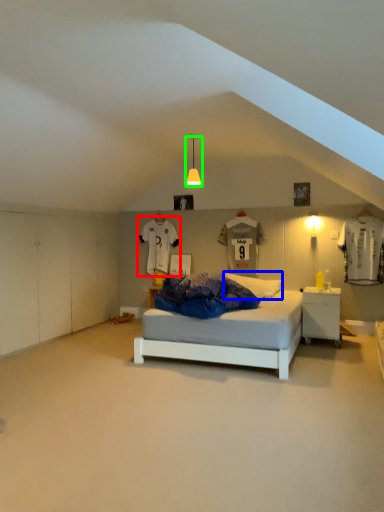
Question: Which is nearer to the t shirt (highlighted by a red box)? pillow (highlighted by a blue box) or light fixture (highlighted by a green box).

Choices:
 (A) pillow
 (B) light fixture

Answer: (B)